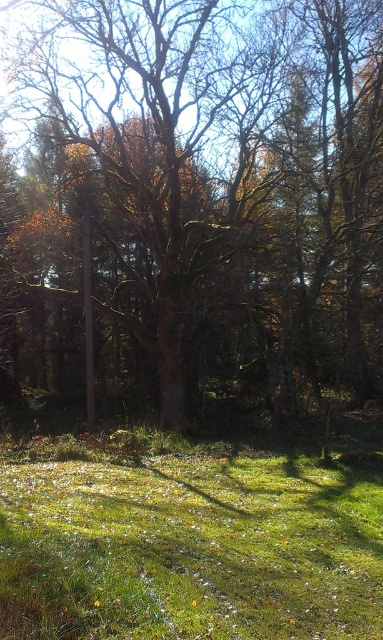
Can you confirm if brown rough tree at center is bigger than green grassy at lower center?

Correct, brown rough tree at center is larger in size than green grassy at lower center.

Which is behind, point (93, 58) or point (60, 632)?

The point (93, 58) is more distant.

Is point (250, 348) closer to camera compared to point (273, 598)?

No.

This screenshot has height=640, width=383. I want to click on brown rough tree at center, so click(x=212, y=188).